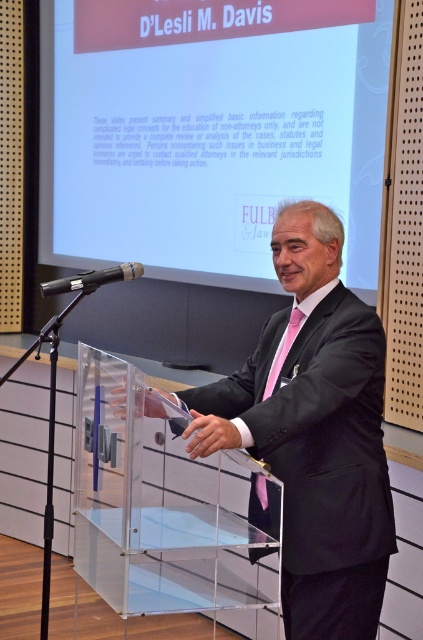
You are an event organizer setting up the room for a presentation. The presenter will be standing at the transparent podium with the letters BIM displayed on it. You need to ensure that the white matte projection screen at upper center is positioned so that the audience can see it clearly from their seats. Based on the given coordinates, is the screen placed correctly for optimal viewing?

The white matte projection screen at upper center is located at point (209, 131). Since this position is at the upper center, it should be visible to the audience from their seats as it is centrally placed and at an appropriate height for viewing.

What is the purpose of the point marked at coordinates (91,280) on the podium?

The point marked at coordinates (91,280) on the podium indicates the location of the black matte microphone positioned at the center of the podium.

You are an attendee at the presentation. You notice two points on the projection screen. The first point is labeled as point 1 at coordinates (269, 324) and the second point is labeled as point 2 at coordinates (266, 396). From your perspective, which point is further back on the screen?

Point 1 at coordinates (269, 324) is further back on the screen compared to point 2 at coordinates (266, 396) because the description states that point 1 is behind point 2.